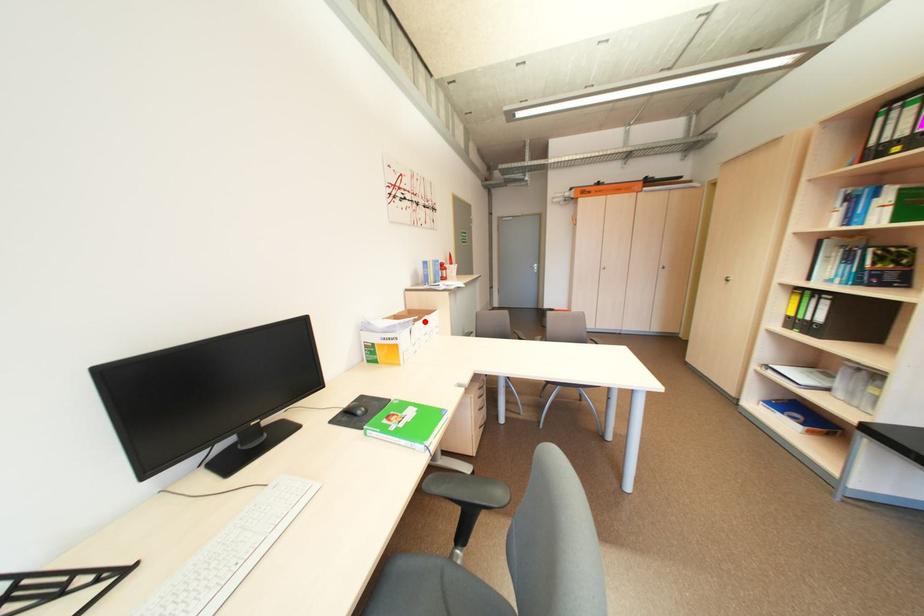
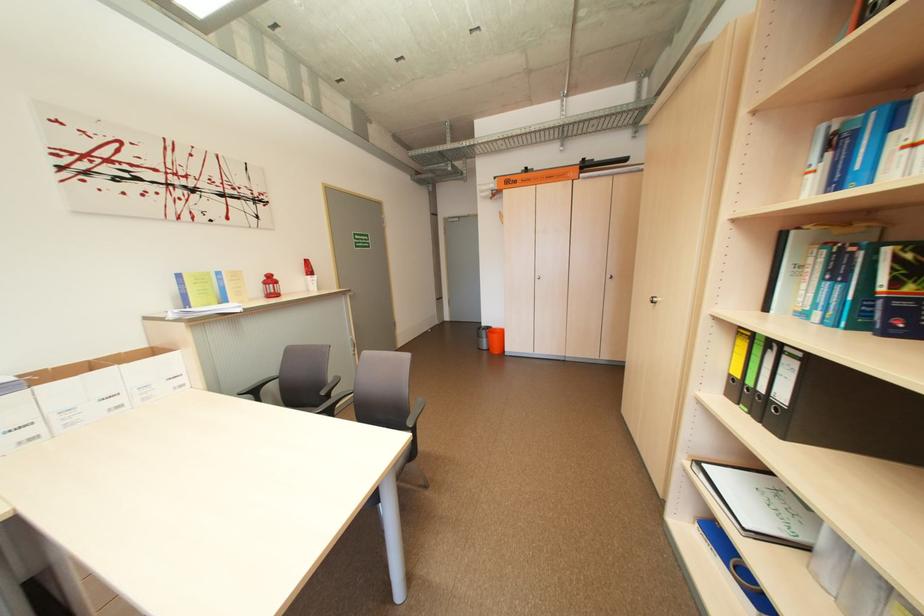
The point at the highlighted location is marked in the first image. Where is the corresponding point in the second image?

(43, 384)